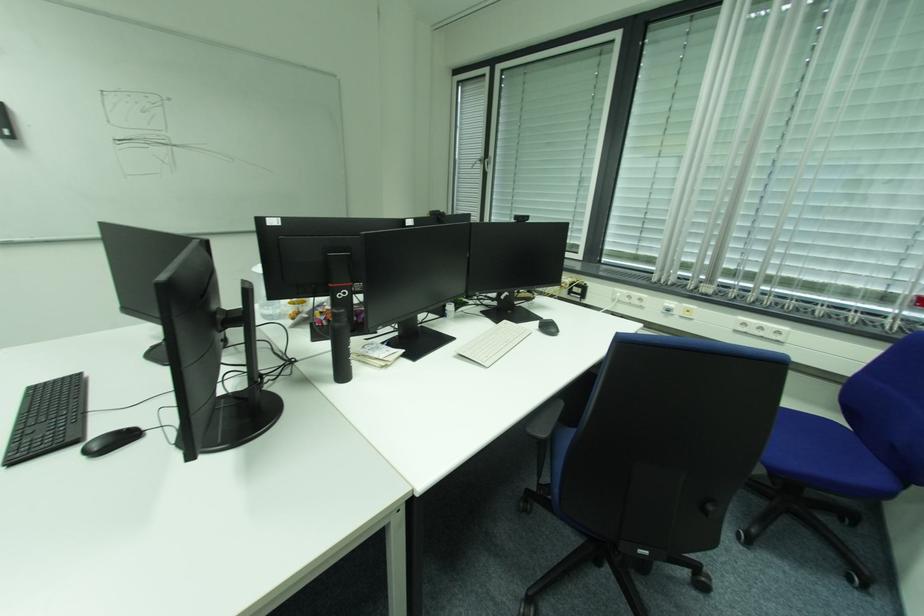
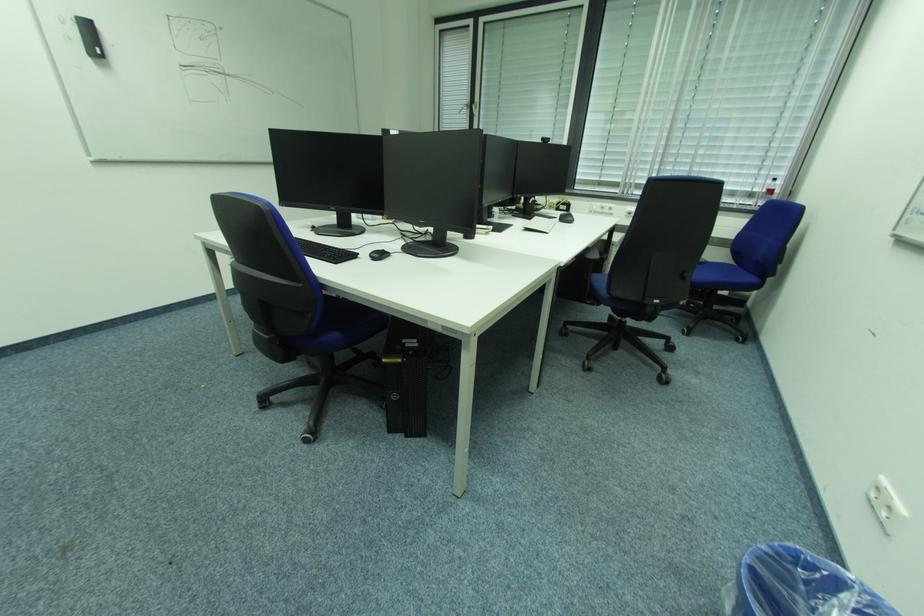
In a continuous first-person perspective shot, in which direction is the camera moving?

The cameraman moved toward left, backward.